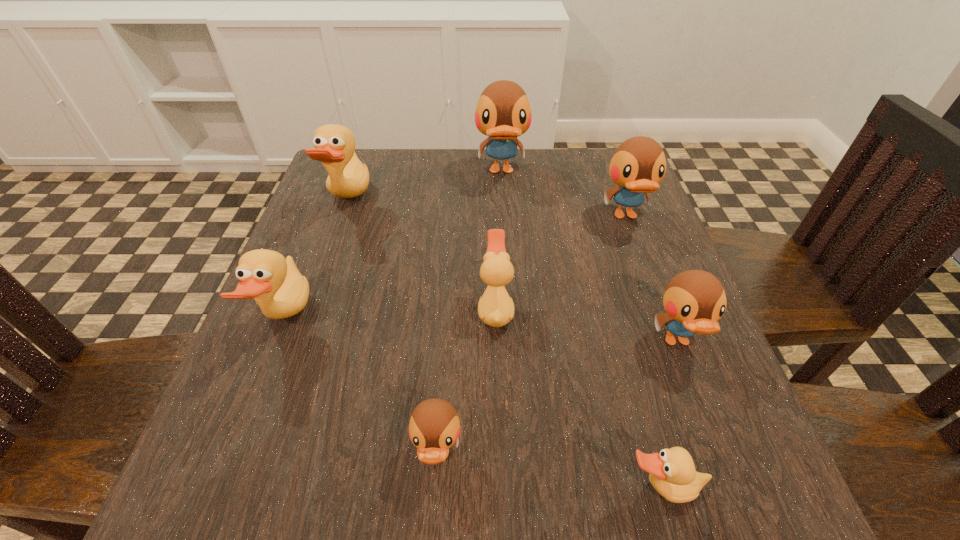
The image size is (960, 540). In order to click on vacant space that is in between the second smallest blue duck and the rightmost tan duck in this screenshot , I will do `click(668, 415)`.

Find the location of `free space that is in between the third smallest blue duck and the smallest blue duck`. free space that is in between the third smallest blue duck and the smallest blue duck is located at coordinates (532, 335).

This screenshot has height=540, width=960. Identify the location of free area in between the third object from left to right and the farthest blue duck. (469, 313).

At what (x,y) coordinates should I click in order to perform the action: click on vacant region between the nearest tan duck and the biggest tan duck. Please return your answer as a coordinate pair (x, y). The width and height of the screenshot is (960, 540). Looking at the image, I should click on (504, 344).

At what (x,y) coordinates should I click in order to perform the action: click on vacant area that lies between the third tan duck from left to right and the second smallest blue duck. Please return your answer as a coordinate pair (x, y). The width and height of the screenshot is (960, 540). Looking at the image, I should click on (587, 325).

The image size is (960, 540). In order to click on free space between the biggest blue duck and the biggest tan duck in this screenshot , I will do [x=425, y=186].

Locate an element on the screen. This screenshot has height=540, width=960. empty space that is in between the second biggest blue duck and the third farthest blue duck is located at coordinates (651, 279).

Find the location of `vacant area that lies between the third biggest blue duck and the third smallest tan duck`. vacant area that lies between the third biggest blue duck and the third smallest tan duck is located at coordinates (482, 330).

Identify the location of vacant area that lies between the second smallest tan duck and the nearest tan duck. Image resolution: width=960 pixels, height=540 pixels. (578, 399).

Locate an element on the screen. vacant space that's between the second farthest blue duck and the second biggest tan duck is located at coordinates tap(456, 267).